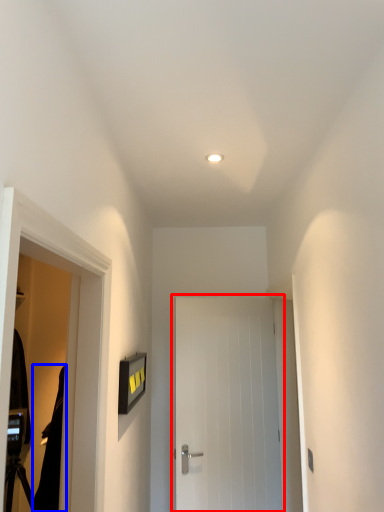
Question: Which object appears closest to the camera in this image, door (highlighted by a red box) or robe (highlighted by a blue box)?

Choices:
 (A) door
 (B) robe

Answer: (B)